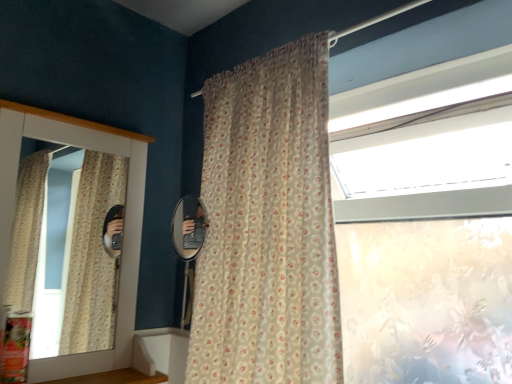
This screenshot has width=512, height=384. Find the location of `wooden at lower left`. wooden at lower left is located at coordinates (114, 378).

Locate an element on the screen. translucent floral-patterned curtain at center is located at coordinates (268, 225).

From the picture: Which is more distant, (99, 358) or (269, 288)?

Point (99, 358)

The image size is (512, 384). What are the coordinates of `medicine cabinet that is under the translucent floral-patterned curtain at center (from a real-world perspective)` in the screenshot? It's located at (126, 219).

Does matte white medicine cabinet at left have a lesser height compared to translucent floral-patterned curtain at center?

Correct, matte white medicine cabinet at left is not as tall as translucent floral-patterned curtain at center.

Is matte white medicine cabinet at left outside of wooden at lower left?

Indeed, matte white medicine cabinet at left is completely outside wooden at lower left.

Is point (82, 130) in front of point (146, 383)?

No, it is behind (146, 383).

Consider the image. Which of these two, matte white medicine cabinet at left or wooden at lower left, is smaller?

Smaller between the two is wooden at lower left.

Is matte white medicine cabinet at left far away from wooden at lower left?

No, matte white medicine cabinet at left is not far from wooden at lower left.

How far apart are wooden at lower left and matte white medicine cabinet at left?

wooden at lower left and matte white medicine cabinet at left are 12.83 inches apart.

Looking at the image, does wooden at lower left seem bigger or smaller compared to matte white medicine cabinet at left?

Clearly, wooden at lower left is smaller in size than matte white medicine cabinet at left.

Is wooden at lower left closer to camera compared to matte white medicine cabinet at left?

Yes, the depth of wooden at lower left is less than that of matte white medicine cabinet at left.

Is wooden at lower left aimed at matte white medicine cabinet at left?

No, wooden at lower left is not turned towards matte white medicine cabinet at left.

Is wooden at lower left surrounded by translucent floral-patterned curtain at center?

No, translucent floral-patterned curtain at center does not contain wooden at lower left.

Considering the sizes of objects translucent floral-patterned curtain at center and wooden at lower left in the image provided, who is bigger, translucent floral-patterned curtain at center or wooden at lower left?

translucent floral-patterned curtain at center is bigger.

In terms of width, does translucent floral-patterned curtain at center look wider or thinner when compared to wooden at lower left?

In the image, translucent floral-patterned curtain at center appears to be wider than wooden at lower left.

Is translucent floral-patterned curtain at center facing away from wooden at lower left?

translucent floral-patterned curtain at center does not have its back to wooden at lower left.

Based on the photo, are translucent floral-patterned curtain at center and matte white medicine cabinet at left far apart?

No, translucent floral-patterned curtain at center is not far from matte white medicine cabinet at left.

From the image's perspective, who appears lower, translucent floral-patterned curtain at center or matte white medicine cabinet at left?

matte white medicine cabinet at left, from the image's perspective.

Is translucent floral-patterned curtain at center in front of or behind matte white medicine cabinet at left in the image?

translucent floral-patterned curtain at center is positioned closer to the viewer than matte white medicine cabinet at left.

From the image's perspective, between wooden at lower left and translucent floral-patterned curtain at center, which one is located above?

translucent floral-patterned curtain at center, from the image's perspective.

Visually, is wooden at lower left positioned to the left or to the right of translucent floral-patterned curtain at center?

wooden at lower left is positioned on translucent floral-patterned curtain at center's left side.

Which is correct: wooden at lower left is inside translucent floral-patterned curtain at center, or outside of it?

The correct answer is: outside.

Looking at this image, from a real-world perspective, is wooden at lower left beneath translucent floral-patterned curtain at center?

Indeed, from a real-world perspective, wooden at lower left is positioned beneath translucent floral-patterned curtain at center.

Locate an element on the screen. medicine cabinet that is under the translucent floral-patterned curtain at center (from a real-world perspective) is located at coordinates (126, 219).

Locate an element on the screen. Image resolution: width=512 pixels, height=384 pixels. window sill on the left of matte white medicine cabinet at left is located at coordinates (114, 378).

Considering their positions, is wooden at lower left positioned closer to translucent floral-patterned curtain at center than matte white medicine cabinet at left?

Based on the image, matte white medicine cabinet at left appears to be nearer to translucent floral-patterned curtain at center.

Considering their positions, is translucent floral-patterned curtain at center positioned closer to wooden at lower left than matte white medicine cabinet at left?

The object closer to wooden at lower left is matte white medicine cabinet at left.

Which object lies further to the anchor point matte white medicine cabinet at left, wooden at lower left or translucent floral-patterned curtain at center?

The object further to matte white medicine cabinet at left is translucent floral-patterned curtain at center.

Consider the image. Based on their spatial positions, is matte white medicine cabinet at left or translucent floral-patterned curtain at center closer to wooden at lower left?

Among the two, matte white medicine cabinet at left is located nearer to wooden at lower left.

When comparing their distances from matte white medicine cabinet at left, does translucent floral-patterned curtain at center or wooden at lower left seem closer?

wooden at lower left.

Estimate the real-world distances between objects in this image. Which object is closer to translucent floral-patterned curtain at center, matte white medicine cabinet at left or wooden at lower left?

The object closer to translucent floral-patterned curtain at center is matte white medicine cabinet at left.

Find the location of `medicine cabinet between wooden at lower left and translucent floral-patterned curtain at center in the horizontal direction`. medicine cabinet between wooden at lower left and translucent floral-patterned curtain at center in the horizontal direction is located at coordinates (126, 219).